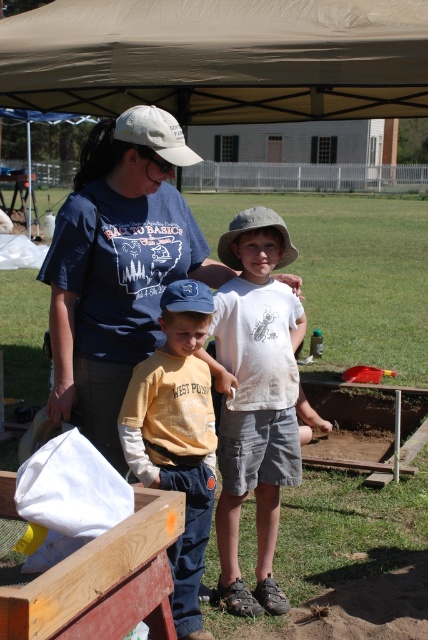
You are a photographer trying to capture a photo of the two baseball caps. The camera you are using has a minimum focus distance of 20 inches. Can you focus on both the khaki fabric baseball hat at center and the blue fabric baseball cap at center simultaneously?

The khaki fabric baseball hat at center and blue fabric baseball cap at center are 21.29 inches apart. Since the minimum focus distance is 20 inches, the distance between them is greater than the camera can handle, so you cannot focus on both simultaneously.

You are standing at the entrance of the beige canopy tent and want to walk towards the two points marked in the image. Which point, point (x=342, y=38) or point (x=291, y=310), will you reach first?

Point (x=342, y=38) is further to the viewer than point (x=291, y=310), so you will reach point (x=342, y=38) first.

You are standing in the outdoor scene under the beige canopy tent. You see two points marked in the image. Which point is closer to you, point at (293, 252) or point at (162, 307)?

Point at (293, 252) is further to the viewer than point at (162, 307), so the closer point is point at (162, 307).